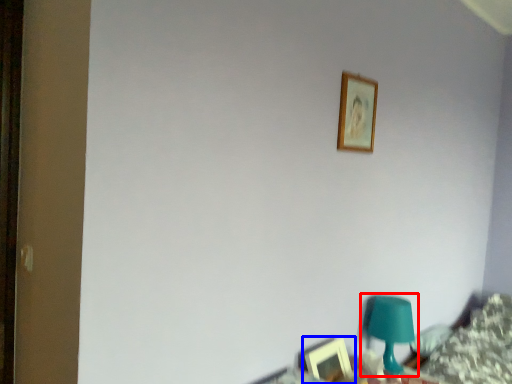
Question: Among these objects, which one is nearest to the camera, table lamp (highlighted by a red box) or picture frame (highlighted by a blue box)?

Choices:
 (A) table lamp
 (B) picture frame

Answer: (B)